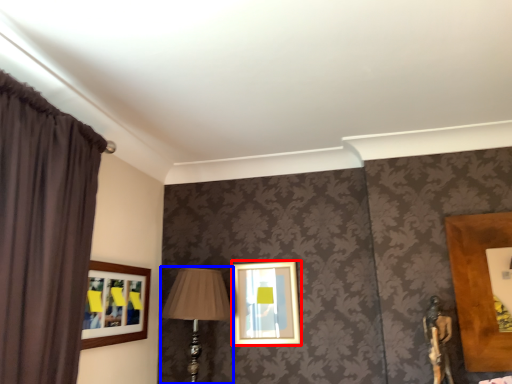
Question: Which object is closer to the camera taking this photo, picture frame (highlighted by a red box) or table lamp (highlighted by a blue box)?

Choices:
 (A) picture frame
 (B) table lamp

Answer: (B)